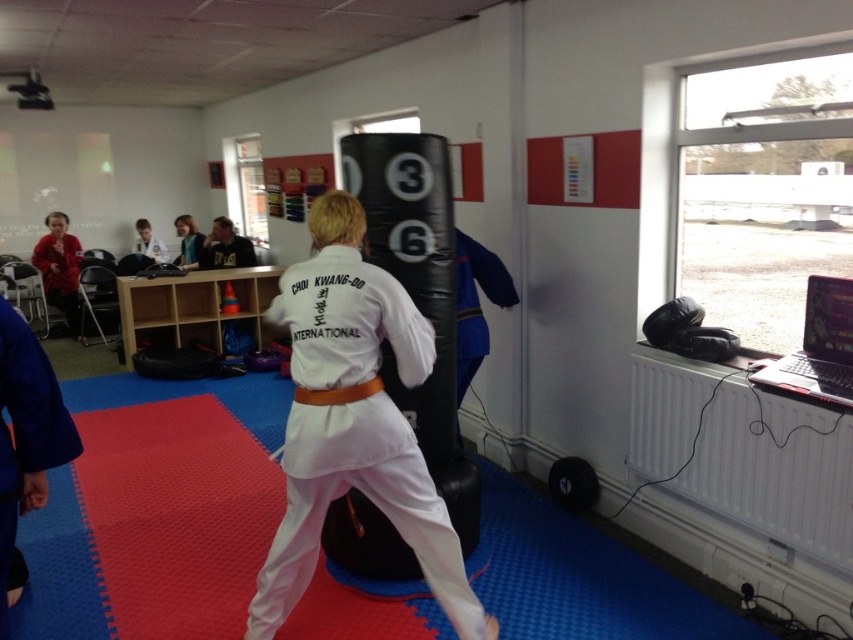
Question: Which object is closer to the camera taking this photo?

Choices:
 (A) matte red jacket at left
 (B) light brown leather jacket at upper left
 (C) white fabric karate gi at center
 (D) smooth blue shirt at upper center

Answer: (C)

Question: Which point appears closest to the camera in this image?

Choices:
 (A) click(354, 317)
 (B) click(175, 221)

Answer: (A)

Question: Which is nearer to the smooth blue shirt at upper center?

Choices:
 (A) white fabric karate gi at center
 (B) matte red jacket at left
 (C) light brown leather jacket at upper left

Answer: (C)

Question: Does white fabric karate gi at center have a lesser width compared to matte red jacket at left?

Choices:
 (A) yes
 (B) no

Answer: (B)

Question: Observing the image, what is the correct spatial positioning of white fabric karate gi at center in reference to light brown leather jacket at upper left?

Choices:
 (A) below
 (B) above

Answer: (A)

Question: Does white fabric karate gi at center have a larger size compared to light brown leather jacket at upper left?

Choices:
 (A) yes
 (B) no

Answer: (A)